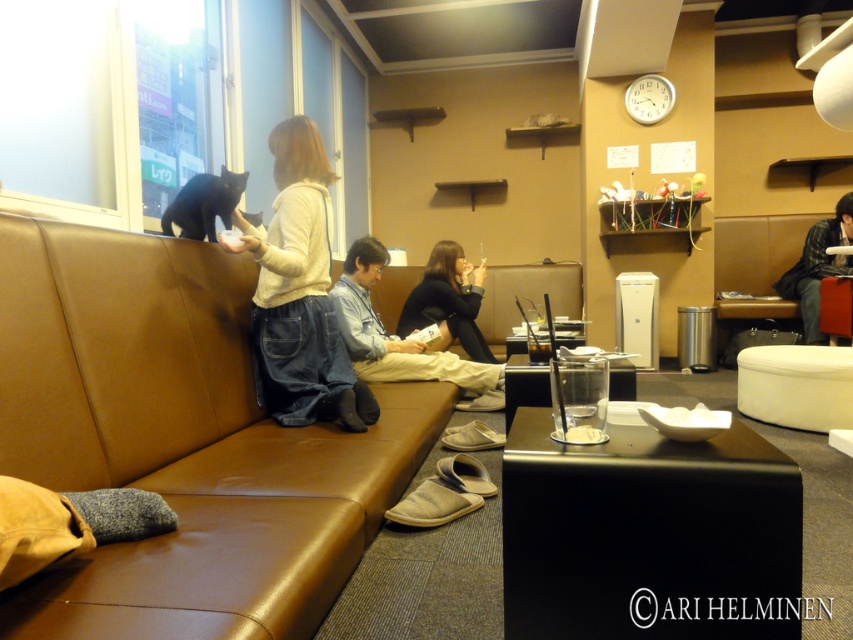
Does brown leather couch at center appear on the right side of denim jeans at center?

Incorrect, brown leather couch at center is not on the right side of denim jeans at center.

Who is shorter, brown leather couch at center or denim jeans at center?

brown leather couch at center is shorter.

Is point (1, 378) positioned after point (408, 349)?

No, it is in front of (408, 349).

Where is `brown leather couch at center`? The width and height of the screenshot is (853, 640). brown leather couch at center is located at coordinates (180, 442).

Does point (248, 225) lie behind point (405, 364)?

No, it is not.

Between point (326, 221) and point (380, 362), which one is positioned behind?

Positioned behind is point (380, 362).

The width and height of the screenshot is (853, 640). In order to click on denim pants at center in this screenshot , I will do `click(300, 292)`.

Measure the distance between brown leather couch at center and black leather jacket at center.

The distance of brown leather couch at center from black leather jacket at center is 5.76 feet.

Is brown leather couch at center behind black leather jacket at center?

No, it is not.

Find the location of a particular element. The height and width of the screenshot is (640, 853). brown leather couch at center is located at coordinates (180, 442).